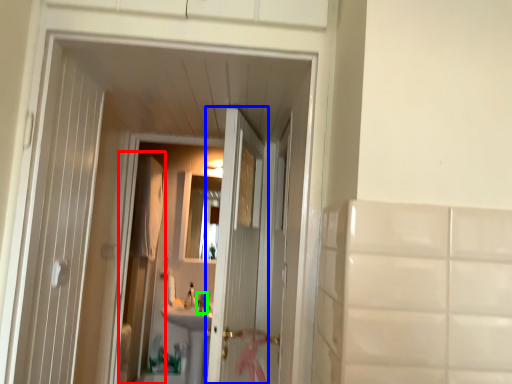
Question: Which object is positioned farthest from screen door (highlighted by a red box)? Select from door (highlighted by a blue box) and faucet (highlighted by a green box).

Choices:
 (A) door
 (B) faucet

Answer: (A)